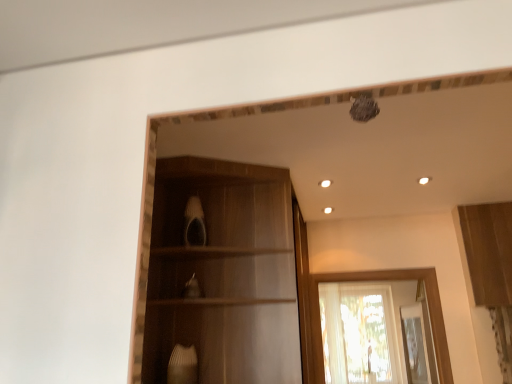
Measure the distance between point (506, 282) and camera.

The distance of point (506, 282) from camera is 9.69 feet.

Locate an element on the screen. This screenshot has height=384, width=512. wooden cabinet at center, the first cabinetry positioned from the left is located at coordinates (222, 273).

In order to click on wooden cabinet at upper right, the 1th cabinetry when ordered from right to left in this screenshot , I will do `click(488, 251)`.

From a real-world perspective, relative to translucent fabric window at center, is wooden cabinet at upper right, the second cabinetry in the left-to-right sequence, vertically above or below?

Clearly, from a real-world perspective, wooden cabinet at upper right, the second cabinetry in the left-to-right sequence, is above translucent fabric window at center.

Could translucent fabric window at center be considered to be inside wooden cabinet at upper right, the second cabinetry in the left-to-right sequence?

No, translucent fabric window at center is not inside wooden cabinet at upper right, the second cabinetry in the left-to-right sequence.

Is wooden cabinet at upper right, the 1th cabinetry when ordered from right to left, further to the viewer compared to translucent fabric window at center?

No, it is in front of translucent fabric window at center.

Find the location of `the 1st cabinetry in front of the translucent fabric window at center, starting your count from the anchor`. the 1st cabinetry in front of the translucent fabric window at center, starting your count from the anchor is located at coordinates pos(488,251).

From the picture: Between wooden cabinet at center, the first cabinetry positioned from the left, and wooden cabinet at upper right, the second cabinetry in the left-to-right sequence, which one appears on the right side from the viewer's perspective?

From the viewer's perspective, wooden cabinet at upper right, the second cabinetry in the left-to-right sequence, appears more on the right side.

Between wooden cabinet at center, the 2th cabinetry when ordered from right to left, and wooden cabinet at upper right, the 1th cabinetry when ordered from right to left, which one is positioned in front?

wooden cabinet at center, the 2th cabinetry when ordered from right to left, is in front.

Where is `cabinetry that is behind the wooden cabinet at center, the 2th cabinetry when ordered from right to left`? Image resolution: width=512 pixels, height=384 pixels. cabinetry that is behind the wooden cabinet at center, the 2th cabinetry when ordered from right to left is located at coordinates (488, 251).

Is wooden cabinet at center, the first cabinetry positioned from the left, beside wooden cabinet at upper right, the second cabinetry in the left-to-right sequence?

There is a gap between wooden cabinet at center, the first cabinetry positioned from the left, and wooden cabinet at upper right, the second cabinetry in the left-to-right sequence.

Is wooden cabinet at upper right, the second cabinetry in the left-to-right sequence, not inside wooden cabinet at center, the first cabinetry positioned from the left?

Yes, wooden cabinet at upper right, the second cabinetry in the left-to-right sequence, is not within wooden cabinet at center, the first cabinetry positioned from the left.

There is a wooden cabinet at center, the 2th cabinetry when ordered from right to left. Where is `cabinetry above it (from a real-world perspective)`? The height and width of the screenshot is (384, 512). cabinetry above it (from a real-world perspective) is located at coordinates (488, 251).

Between wooden cabinet at upper right, the second cabinetry in the left-to-right sequence, and wooden cabinet at center, the 2th cabinetry when ordered from right to left, which one appears on the right side from the viewer's perspective?

wooden cabinet at upper right, the second cabinetry in the left-to-right sequence, is more to the right.

Does wooden cabinet at upper right, the second cabinetry in the left-to-right sequence, turn towards wooden cabinet at center, the 2th cabinetry when ordered from right to left?

No.

Which of these two, translucent fabric window at center or wooden cabinet at center, the 2th cabinetry when ordered from right to left, is bigger?

Bigger between the two is wooden cabinet at center, the 2th cabinetry when ordered from right to left.

Is wooden cabinet at center, the first cabinetry positioned from the left, at the back of translucent fabric window at center?

No, translucent fabric window at center is not facing away from wooden cabinet at center, the first cabinetry positioned from the left.

Between translucent fabric window at center and wooden cabinet at center, the 2th cabinetry when ordered from right to left, which one has smaller width?

With smaller width is translucent fabric window at center.

Would you say translucent fabric window at center contains wooden cabinet at center, the 2th cabinetry when ordered from right to left?

Definitely not — wooden cabinet at center, the 2th cabinetry when ordered from right to left, is not inside translucent fabric window at center.

Are translucent fabric window at center and wooden cabinet at upper right, the second cabinetry in the left-to-right sequence, making contact?

No, translucent fabric window at center is not beside wooden cabinet at upper right, the second cabinetry in the left-to-right sequence.

What's the angular difference between translucent fabric window at center and wooden cabinet at upper right, the 1th cabinetry when ordered from right to left,'s facing directions?

2.8 degrees.

The width and height of the screenshot is (512, 384). Identify the location of window below the wooden cabinet at upper right, the 1th cabinetry when ordered from right to left (from a real-world perspective). [358, 333].

In the scene shown: Relative to translucent fabric window at center, is wooden cabinet at center, the 2th cabinetry when ordered from right to left, in front or behind?

Visually, wooden cabinet at center, the 2th cabinetry when ordered from right to left, is located in front of translucent fabric window at center.

Locate an element on the screen. cabinetry on the left of translucent fabric window at center is located at coordinates (222, 273).

From a real-world perspective, is wooden cabinet at center, the first cabinetry positioned from the left, on top of translucent fabric window at center?

Indeed, from a real-world perspective, wooden cabinet at center, the first cabinetry positioned from the left, stands above translucent fabric window at center.

Can you confirm if wooden cabinet at center, the first cabinetry positioned from the left, is wider than translucent fabric window at center?

Yes.

This screenshot has width=512, height=384. What are the coordinates of `the 2nd cabinetry positioned above the translucent fabric window at center (from a real-world perspective)` in the screenshot? It's located at (488, 251).

Identify the location of cabinetry that appears behind the wooden cabinet at center, the 2th cabinetry when ordered from right to left. (488, 251).

Looking at the image, which one is located further to translucent fabric window at center, wooden cabinet at center, the first cabinetry positioned from the left, or wooden cabinet at upper right, the second cabinetry in the left-to-right sequence?

wooden cabinet at center, the first cabinetry positioned from the left, is positioned further to the anchor translucent fabric window at center.

Considering their positions, is translucent fabric window at center positioned further to wooden cabinet at center, the 2th cabinetry when ordered from right to left, than wooden cabinet at upper right, the 1th cabinetry when ordered from right to left?

wooden cabinet at upper right, the 1th cabinetry when ordered from right to left, is further to wooden cabinet at center, the 2th cabinetry when ordered from right to left.

Looking at this image, considering their positions, is wooden cabinet at upper right, the second cabinetry in the left-to-right sequence, positioned closer to wooden cabinet at center, the first cabinetry positioned from the left, than translucent fabric window at center?

translucent fabric window at center is closer to wooden cabinet at center, the first cabinetry positioned from the left.

Based on their spatial positions, is translucent fabric window at center or wooden cabinet at center, the first cabinetry positioned from the left, further from wooden cabinet at upper right, the second cabinetry in the left-to-right sequence?

wooden cabinet at center, the first cabinetry positioned from the left.

Considering their positions, is wooden cabinet at upper right, the 1th cabinetry when ordered from right to left, positioned closer to translucent fabric window at center than wooden cabinet at center, the 2th cabinetry when ordered from right to left?

wooden cabinet at upper right, the 1th cabinetry when ordered from right to left, is positioned closer to the anchor translucent fabric window at center.

Which object lies nearer to the anchor point wooden cabinet at upper right, the 1th cabinetry when ordered from right to left, wooden cabinet at center, the first cabinetry positioned from the left, or translucent fabric window at center?

The object closer to wooden cabinet at upper right, the 1th cabinetry when ordered from right to left, is translucent fabric window at center.

The height and width of the screenshot is (384, 512). I want to click on cabinetry positioned between wooden cabinet at center, the 2th cabinetry when ordered from right to left, and translucent fabric window at center from near to far, so click(488, 251).